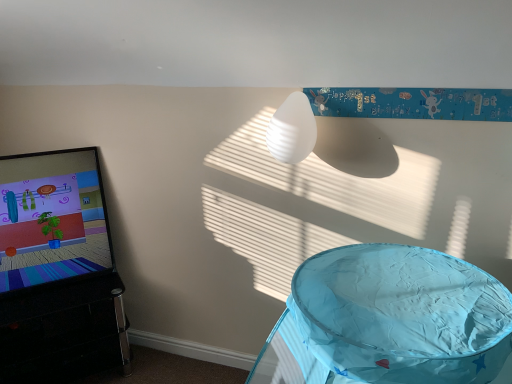
Question: Is matte black screen at left shorter than white ribbed lampshade at upper center?

Choices:
 (A) yes
 (B) no

Answer: (B)

Question: Is matte black screen at left in contact with white ribbed lampshade at upper center?

Choices:
 (A) no
 (B) yes

Answer: (A)

Question: Is matte black screen at left positioned with its back to white ribbed lampshade at upper center?

Choices:
 (A) yes
 (B) no

Answer: (B)

Question: From a real-world perspective, is matte black screen at left physically below white ribbed lampshade at upper center?

Choices:
 (A) no
 (B) yes

Answer: (B)

Question: Can you confirm if matte black screen at left is positioned to the right of white ribbed lampshade at upper center?

Choices:
 (A) yes
 (B) no

Answer: (B)

Question: Based on their sizes in the image, would you say white ribbed lampshade at upper center is bigger or smaller than matte black screen at left?

Choices:
 (A) small
 (B) big

Answer: (A)

Question: In terms of height, does white ribbed lampshade at upper center look taller or shorter compared to matte black screen at left?

Choices:
 (A) short
 (B) tall

Answer: (A)

Question: Is white ribbed lampshade at upper center wider or thinner than matte black screen at left?

Choices:
 (A) wide
 (B) thin

Answer: (B)

Question: From the image's perspective, is white ribbed lampshade at upper center positioned above or below matte black screen at left?

Choices:
 (A) above
 (B) below

Answer: (A)

Question: Considering the positions of point (305, 97) and point (51, 311), is point (305, 97) closer or farther from the camera than point (51, 311)?

Choices:
 (A) farther
 (B) closer

Answer: (B)

Question: Looking at their shapes, would you say white ribbed lampshade at upper center is wider or thinner than black glossy tv stand at left, placed as the second furniture when sorted from right to left?

Choices:
 (A) wide
 (B) thin

Answer: (B)

Question: In the image, is white ribbed lampshade at upper center on the left side or the right side of black glossy tv stand at left, which ranks as the 2th furniture in front-to-back order?

Choices:
 (A) left
 (B) right

Answer: (B)

Question: From the image's perspective, is white ribbed lampshade at upper center above or below black glossy tv stand at left, placed as the second furniture when sorted from right to left?

Choices:
 (A) below
 (B) above

Answer: (B)

Question: Would you say blue fabric play tent at lower right, placed as the first furniture when sorted from right to left, is to the left or to the right of matte black screen at left in the picture?

Choices:
 (A) left
 (B) right

Answer: (B)

Question: From the image's perspective, relative to matte black screen at left, is blue fabric play tent at lower right, positioned as the second furniture in left-to-right order, above or below?

Choices:
 (A) below
 (B) above

Answer: (A)